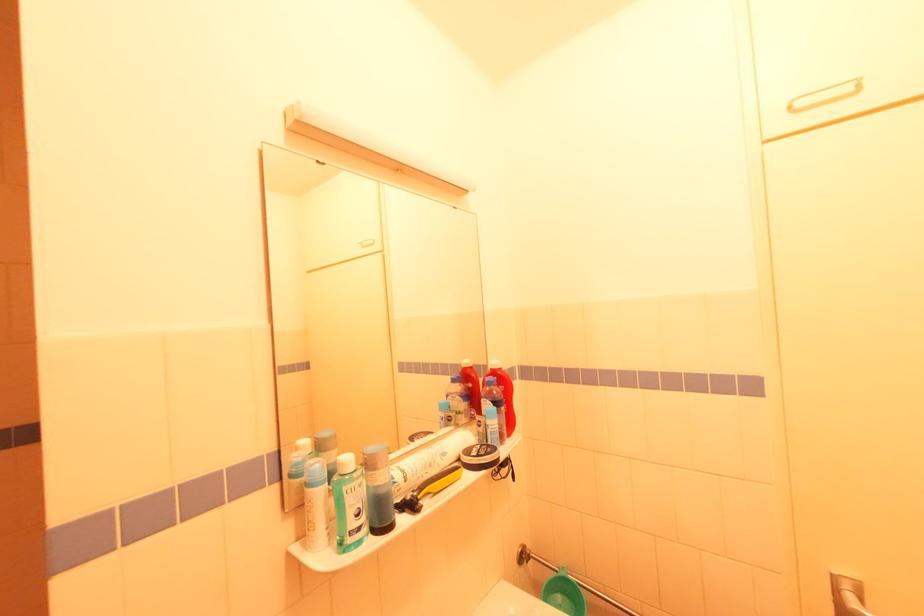
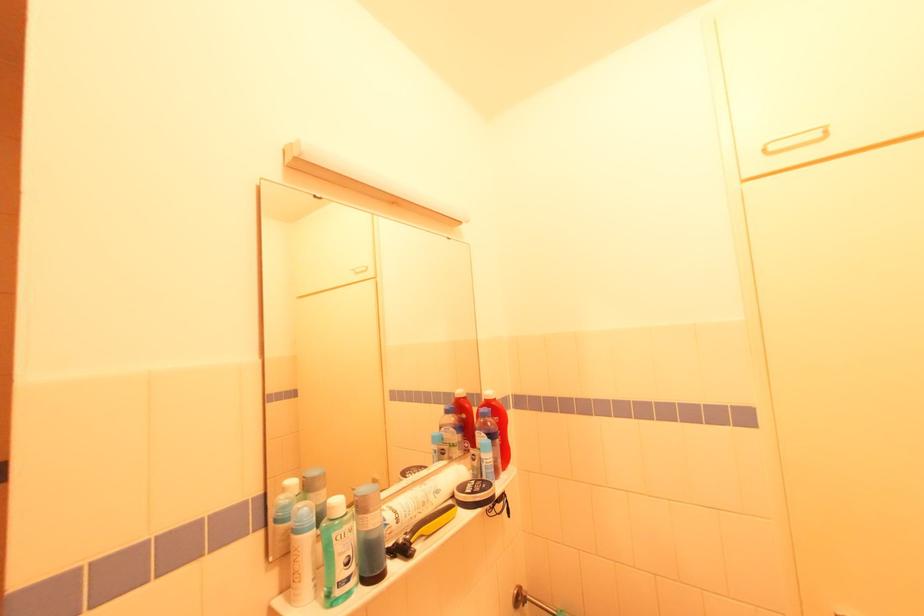
The point at (521,552) is marked in the first image. Where is the corresponding point in the second image?

(517, 594)